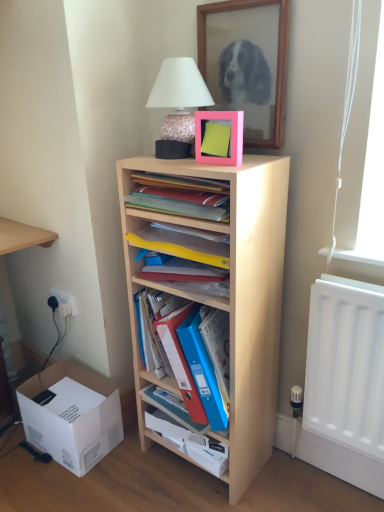
This screenshot has width=384, height=512. Find the location of `vacant space in front of matte white lampshade at upper center`. vacant space in front of matte white lampshade at upper center is located at coordinates (193, 160).